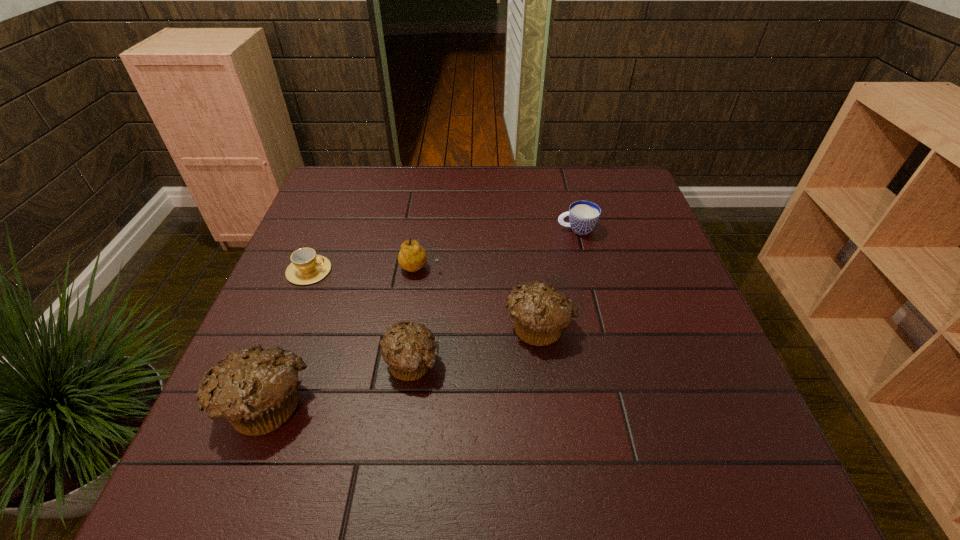
The width and height of the screenshot is (960, 540). I want to click on free spot between the leftmost muffin and the nearer cup, so click(x=287, y=337).

You are a GUI agent. You are given a task and a screenshot of the screen. Output one action in this format:
    pyautogui.click(x=<x>, y=<y>)
    Task: Click on the free space between the second tallest muffin and the shortest muffin
    Image resolution: width=960 pixels, height=540 pixels.
    Given the screenshot: What is the action you would take?
    pyautogui.click(x=475, y=343)

At what (x,y) coordinates should I click in order to perform the action: click on vacant space in between the rightmost object and the second object from right to left. Please return your answer as a coordinate pair (x, y). The image size is (960, 540). Looking at the image, I should click on (558, 277).

In order to click on vacant space that's between the fifth tallest object and the shorter cup in this screenshot , I will do `click(443, 250)`.

Locate an element on the screen. The image size is (960, 540). vacant space in between the taller cup and the leftmost muffin is located at coordinates (420, 316).

I want to click on vacant space that is in between the fifth tallest object and the pear, so click(x=498, y=248).

I want to click on vacant space that is in between the nearer cup and the farthest object, so click(443, 250).

You are a GUI agent. You are given a task and a screenshot of the screen. Output one action in this format:
    pyautogui.click(x=<x>, y=<y>)
    Task: Click on the object that is the closest to the shortest muffin
    This screenshot has width=960, height=540.
    Given the screenshot: What is the action you would take?
    pyautogui.click(x=254, y=389)

Identify which object is the third nearest to the pear. Please provide its 2D coordinates. Your answer should be formatted as a tuple, i.e. [(x, y)], where the tuple contains the x and y coordinates of a point satisfying the conditions above.

[(409, 351)]

Identify which muffin is the nearest to the leftmost muffin. Please provide its 2D coordinates. Your answer should be formatted as a tuple, i.e. [(x, y)], where the tuple contains the x and y coordinates of a point satisfying the conditions above.

[(409, 351)]